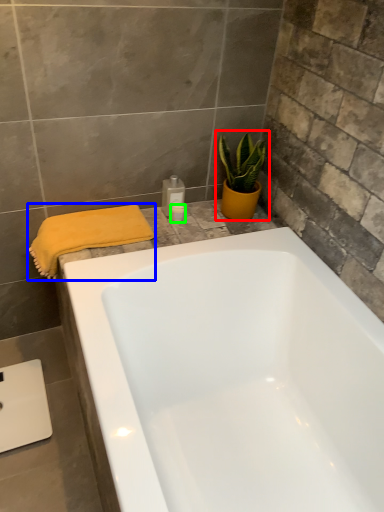
Question: Which object is positioned closest to houseplant (highlighted by a red box)? Select from bath towel (highlighted by a blue box) and toiletry (highlighted by a green box).

Choices:
 (A) bath towel
 (B) toiletry

Answer: (B)